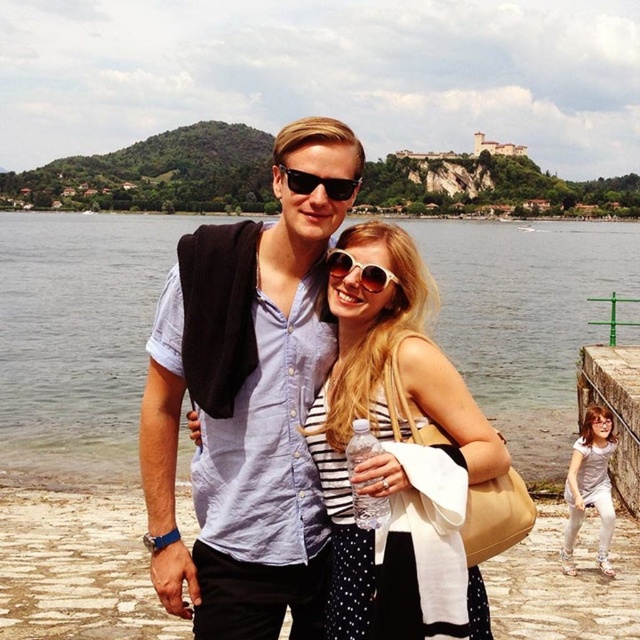
Image resolution: width=640 pixels, height=640 pixels. I want to click on matte blue shirt at center, so click(250, 412).

In the scene shown: Who is higher up, matte blue shirt at center or black plastic sunglasses at center?

black plastic sunglasses at center is above.

Who is more distant from viewer, (168, 564) or (284, 164)?

Answer: Positioned behind is point (284, 164).

This screenshot has height=640, width=640. Identify the location of matte blue shirt at center. (250, 412).

Which of these two, clear water at center or sunglasses at center, stands taller?

clear water at center is taller.

Does clear water at center have a greater width compared to sunglasses at center?

Correct, the width of clear water at center exceeds that of sunglasses at center.

At what (x,y) coordinates should I click in order to perform the action: click on clear water at center. Please return your answer as a coordinate pair (x, y). Image resolution: width=640 pixels, height=640 pixels. Looking at the image, I should click on (76, 337).

Image resolution: width=640 pixels, height=640 pixels. What are the coordinates of `clear water at center` in the screenshot? It's located at (76, 337).

Measure the distance from matte blue shirt at center to light pink fabric dress at lower right.

matte blue shirt at center and light pink fabric dress at lower right are 24.00 meters apart from each other.

Does matte blue shirt at center have a greater height compared to light pink fabric dress at lower right?

Yes.

Does point (243, 224) come farther from viewer compared to point (593, 488)?

No, (243, 224) is closer to viewer.

What are the coordinates of `matte blue shirt at center` in the screenshot? It's located at (250, 412).